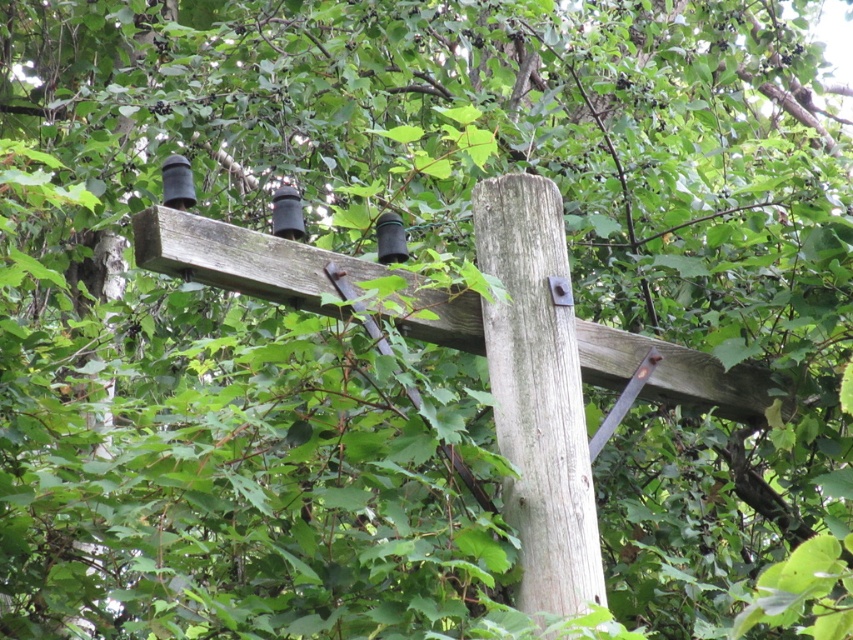
Question: Does gray wood telegraph pole at center have a smaller size compared to weathered wood beam at center?

Choices:
 (A) no
 (B) yes

Answer: (B)

Question: Does gray wood telegraph pole at center lie behind weathered wood beam at center?

Choices:
 (A) yes
 (B) no

Answer: (A)

Question: Can you confirm if gray wood telegraph pole at center is bigger than weathered wood beam at center?

Choices:
 (A) no
 (B) yes

Answer: (A)

Question: Which point is farther to the camera?

Choices:
 (A) weathered wood beam at center
 (B) gray wood telegraph pole at center

Answer: (B)